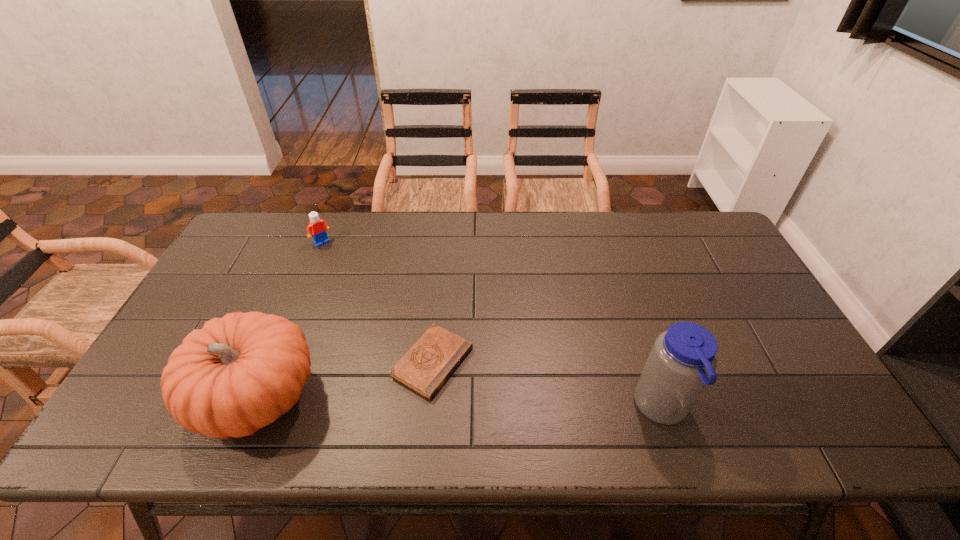
At what (x,y) coordinates should I click in order to perform the action: click on empty space between the shortest object and the Lego. Please return your answer as a coordinate pair (x, y). Image resolution: width=960 pixels, height=540 pixels. Looking at the image, I should click on (377, 302).

At what (x,y) coordinates should I click in order to perform the action: click on vacant point located between the farthest object and the second tallest object. Please return your answer as a coordinate pair (x, y). Image resolution: width=960 pixels, height=540 pixels. Looking at the image, I should click on (290, 320).

You are a GUI agent. You are given a task and a screenshot of the screen. Output one action in this format:
    pyautogui.click(x=<x>, y=<y>)
    Task: Click on the free area in between the water bottle and the pumpkin
    The width and height of the screenshot is (960, 540).
    Given the screenshot: What is the action you would take?
    pyautogui.click(x=460, y=403)

Where is `unoccupied position between the rightmost object and the diary`? The image size is (960, 540). unoccupied position between the rightmost object and the diary is located at coordinates (547, 385).

Where is `free space between the third object from left to right and the second shortest object`? This screenshot has height=540, width=960. free space between the third object from left to right and the second shortest object is located at coordinates (377, 302).

Where is `the closest object to the water bottle`? The height and width of the screenshot is (540, 960). the closest object to the water bottle is located at coordinates (429, 363).

Locate which object ranks second in proximity to the shortest object. Please provide its 2D coordinates. Your answer should be formatted as a tuple, i.e. [(x, y)], where the tuple contains the x and y coordinates of a point satisfying the conditions above.

[(683, 359)]

At what (x,y) coordinates should I click in order to perform the action: click on free spot that satisfies the following two spatial constraints: 1. on the front side of the second object from right to left; 2. on the right side of the third tallest object. Please return your answer as a coordinate pair (x, y). The height and width of the screenshot is (540, 960). Looking at the image, I should click on (274, 362).

At what (x,y) coordinates should I click in order to perform the action: click on vacant space that satisfies the following two spatial constraints: 1. on the front side of the farthest object; 2. with a carrying loop on the side of the water bottle. Please return your answer as a coordinate pair (x, y). The image size is (960, 540). Looking at the image, I should click on (254, 408).

You are a GUI agent. You are given a task and a screenshot of the screen. Output one action in this format:
    pyautogui.click(x=<x>, y=<y>)
    Task: Click on the free space in the image that satisfies the following two spatial constraints: 1. on the front side of the water bottle; 2. with a carrying loop on the side of the shortest object
    The width and height of the screenshot is (960, 540).
    Given the screenshot: What is the action you would take?
    pos(428,408)